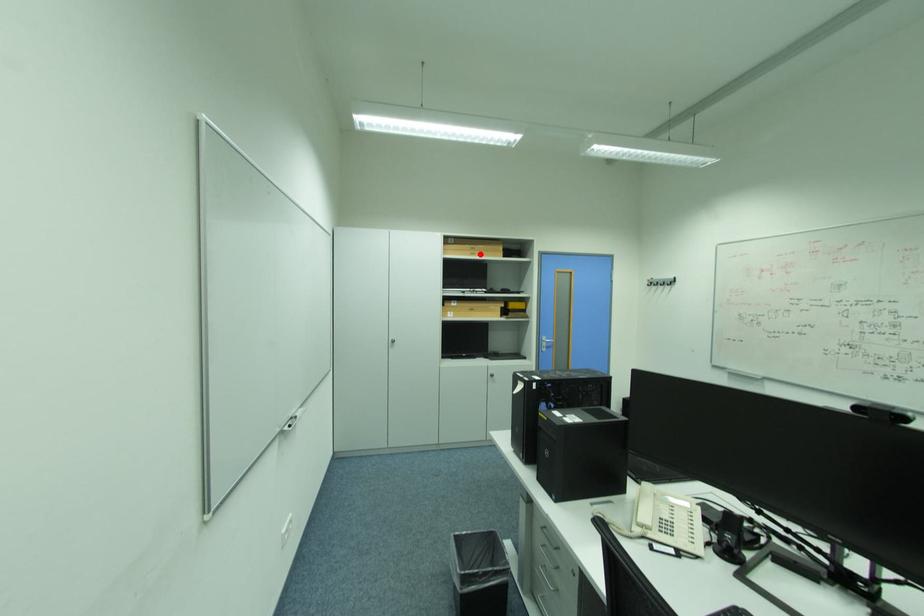
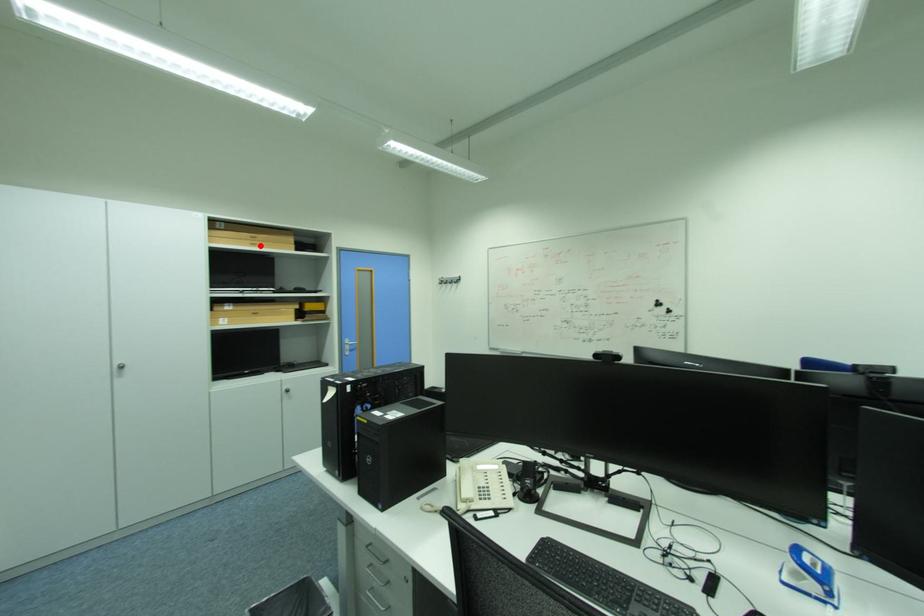
I am providing you with two images of the same scene from different viewpoints. A red point is marked on the first image and another point is marked on the second image. Are the points marked in image1 and image2 representing the same 3D position?

Yes